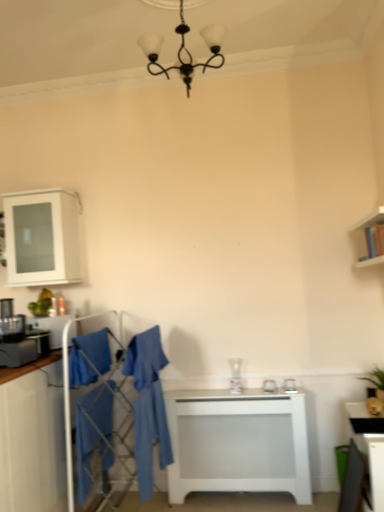
The height and width of the screenshot is (512, 384). Describe the element at coordinates (32, 437) in the screenshot. I see `matte white cabinet at left, the 2th cabinetry positioned from the top` at that location.

This screenshot has height=512, width=384. Describe the element at coordinates (145, 358) in the screenshot. I see `blue fabric robe at center, which is counted as the second robe, starting from the right` at that location.

Describe the element at coordinates (238, 443) in the screenshot. The height and width of the screenshot is (512, 384). I see `white matte table at center, which is counted as the first table, starting from the back` at that location.

The height and width of the screenshot is (512, 384). What are the coordinates of `matte black chair at lower right` in the screenshot? It's located at (354, 481).

Describe the element at coordinates (184, 50) in the screenshot. I see `black glass chandelier at upper center` at that location.

You are a GUI agent. You are given a task and a screenshot of the screen. Output one action in this format:
    pyautogui.click(x=<x>, y=<y>)
    Task: Click on the matte white cabinet at left, the 2th cabinetry positioned from the top
    This screenshot has width=384, height=512.
    Given the screenshot: What is the action you would take?
    pyautogui.click(x=32, y=437)

Considering the sizes of objects white glossy table at lower right, which ranks as the 2th table in left-to-right order, and matte black chair at lower right in the image provided, who is shorter, white glossy table at lower right, which ranks as the 2th table in left-to-right order, or matte black chair at lower right?

matte black chair at lower right.

Is white glossy table at lower right, which ranks as the 2th table in left-to-right order, facing away from matte black chair at lower right?

That's right, white glossy table at lower right, which ranks as the 2th table in left-to-right order, is facing away from matte black chair at lower right.

Is white glossy table at lower right, which is the 1th table in right-to-left order, next to matte black chair at lower right and touching it?

They are not placed beside each other.

Is white glossy table at lower right, the 2th table when ordered from back to front, positioned beyond the bounds of matte black chair at lower right?

white glossy table at lower right, the 2th table when ordered from back to front, lies outside matte black chair at lower right's area.

Is white glossy vase at center, which is the second appliance in front-to-back order, facing away from blue fabric swivel chair at center?

white glossy vase at center, which is the second appliance in front-to-back order, is not turned away from blue fabric swivel chair at center.

The width and height of the screenshot is (384, 512). Find the location of `appliance on the right of blue fabric swivel chair at center`. appliance on the right of blue fabric swivel chair at center is located at coordinates (290, 386).

Can you tell me how much white glossy vase at center, the 1th appliance viewed from the right, and blue fabric swivel chair at center differ in facing direction?

7.27 degrees separate the facing orientations of white glossy vase at center, the 1th appliance viewed from the right, and blue fabric swivel chair at center.

Considering the positions of point (287, 382) and point (100, 415), is point (287, 382) closer or farther from the camera than point (100, 415)?

Point (287, 382) is positioned farther from the camera compared to point (100, 415).

Measure the distance from blue cotton robe at lower left, the second robe when ordered from left to right, to matte white cabinet at left, the 2th cabinetry positioned from the top.

12.72 inches.

Is blue cotton robe at lower left, the third robe from the right, positioned behind matte white cabinet at left, the 2th cabinetry positioned from the top?

Yes.

How different are the orientations of blue cotton robe at lower left, the second robe when ordered from left to right, and matte white cabinet at left, which ranks as the first cabinetry in bottom-to-top order, in degrees?

blue cotton robe at lower left, the second robe when ordered from left to right, and matte white cabinet at left, which ranks as the first cabinetry in bottom-to-top order, are facing 179 degrees away from each other.

Considering the relative positions of blue cotton robe at lower left, the second robe when ordered from left to right, and matte white cabinet at left, the 2th cabinetry positioned from the top, in the image provided, is blue cotton robe at lower left, the second robe when ordered from left to right, to the left or to the right of matte white cabinet at left, the 2th cabinetry positioned from the top,?

In the image, blue cotton robe at lower left, the second robe when ordered from left to right, appears on the right side of matte white cabinet at left, the 2th cabinetry positioned from the top.

This screenshot has height=512, width=384. I want to click on the 2nd cabinetry above the blue cotton robe at center, arranged as the 1th robe when viewed from the right (from the image's perspective), so click(x=42, y=237).

Consider the image. From a real-world perspective, is white glossy cabinet at upper left, which is the 1th cabinetry in top-to-bottom order, on blue cotton robe at center, which appears as the 4th robe when viewed from the left?

Yes, from a real-world perspective, white glossy cabinet at upper left, which is the 1th cabinetry in top-to-bottom order, is on top of blue cotton robe at center, which appears as the 4th robe when viewed from the left.

Based on their positions, is white glossy cabinet at upper left, the 2th cabinetry when ordered from bottom to top, located to the left or right of blue cotton robe at center, which appears as the 4th robe when viewed from the left?

white glossy cabinet at upper left, the 2th cabinetry when ordered from bottom to top, is to the left of blue cotton robe at center, which appears as the 4th robe when viewed from the left.

Is white matte table at center, which is counted as the first table, starting from the back, next to white glossy cabinet at upper left, the 2th cabinetry when ordered from bottom to top, and touching it?

No, white matte table at center, which is counted as the first table, starting from the back, is not making contact with white glossy cabinet at upper left, the 2th cabinetry when ordered from bottom to top.

From a real-world perspective, is white matte table at center, which is counted as the first table, starting from the back, located beneath white glossy cabinet at upper left, which is the 1th cabinetry in top-to-bottom order?

Yes, from a real-world perspective, white matte table at center, which is counted as the first table, starting from the back, is beneath white glossy cabinet at upper left, which is the 1th cabinetry in top-to-bottom order.

Between white matte table at center, the second table positioned from the right, and white glossy cabinet at upper left, the 2th cabinetry when ordered from bottom to top, which one has smaller size?

Smaller between the two is white glossy cabinet at upper left, the 2th cabinetry when ordered from bottom to top.

Which is behind, white matte table at center, placed as the 1th table when sorted from left to right, or white glossy cabinet at upper left, the 2th cabinetry when ordered from bottom to top?

white glossy cabinet at upper left, the 2th cabinetry when ordered from bottom to top, is further away from the camera.

Considering the points (155, 418) and (56, 270), which point is behind, point (155, 418) or point (56, 270)?

The point (56, 270) is farther from the camera.

Does blue cotton robe at center, which appears as the 4th robe when viewed from the left, have a smaller size compared to white glossy cabinet at upper left, which is the 1th cabinetry in top-to-bottom order?

Correct, blue cotton robe at center, which appears as the 4th robe when viewed from the left, occupies less space than white glossy cabinet at upper left, which is the 1th cabinetry in top-to-bottom order.

From the image's perspective, would you say blue cotton robe at center, arranged as the 1th robe when viewed from the right, is positioned over white glossy cabinet at upper left, which is the 1th cabinetry in top-to-bottom order?

Actually, blue cotton robe at center, arranged as the 1th robe when viewed from the right, appears below white glossy cabinet at upper left, which is the 1th cabinetry in top-to-bottom order, in the image.

From a real-world perspective, is blue cotton robe at center, arranged as the 1th robe when viewed from the right, positioned over white glossy cabinet at upper left, which is the 1th cabinetry in top-to-bottom order, based on gravity?

No, from a real-world perspective, blue cotton robe at center, arranged as the 1th robe when viewed from the right, is not above white glossy cabinet at upper left, which is the 1th cabinetry in top-to-bottom order.

Is white matte table at center, the second table positioned from the right, surrounded by blue fabric robe at center, positioned as the third robe in left-to-right order?

No, blue fabric robe at center, positioned as the third robe in left-to-right order, does not contain white matte table at center, the second table positioned from the right.

Which is less distant, [127,375] or [264,417]?

The point [264,417] is closer to the camera.

In the scene shown: Which of these two, blue fabric robe at center, which is counted as the second robe, starting from the right, or white matte table at center, the second table positioned from the right, stands shorter?

blue fabric robe at center, which is counted as the second robe, starting from the right, is shorter.

Can you see blue fabric robe at center, which is counted as the second robe, starting from the right, touching white matte table at center, marked as the 2th table in a front-to-back arrangement?

No, blue fabric robe at center, which is counted as the second robe, starting from the right, is not beside white matte table at center, marked as the 2th table in a front-to-back arrangement.

Where is `table lying on the right of matte black chair at lower right`? table lying on the right of matte black chair at lower right is located at coordinates (369, 446).

This screenshot has height=512, width=384. I want to click on swivel chair in front of the white glossy vase at center, the second appliance viewed from the left, so click(x=148, y=405).

Which object lies further to the anchor point white glossy cabinet at upper left, which is the 1th cabinetry in top-to-bottom order, blue cotton robe at lower left, the third robe from the right, or white matte table at center, marked as the 2th table in a front-to-back arrangement?

white matte table at center, marked as the 2th table in a front-to-back arrangement, lies further to white glossy cabinet at upper left, which is the 1th cabinetry in top-to-bottom order, than the other object.

From the image, which object appears to be nearer to blue cotton robe at center, arranged as the 1th robe when viewed from the right, matte white cabinet at left, the 2th cabinetry positioned from the top, or blue fabric swivel chair at center?

blue fabric swivel chair at center lies closer to blue cotton robe at center, arranged as the 1th robe when viewed from the right, than the other object.

Looking at the image, which one is located closer to blue fabric robe at center, marked as the first robe in a left-to-right arrangement, matte black chair at lower right or white glossy cabinet at upper left, which is the 1th cabinetry in top-to-bottom order?

The object closer to blue fabric robe at center, marked as the first robe in a left-to-right arrangement, is white glossy cabinet at upper left, which is the 1th cabinetry in top-to-bottom order.

Based on the photo, which object lies nearer to the anchor point white matte table at center, the second table positioned from the right, blue fabric robe at center, which is counted as the second robe, starting from the right, or blue fabric swivel chair at center?

The object closer to white matte table at center, the second table positioned from the right, is blue fabric swivel chair at center.

Looking at the image, which one is located closer to blue cotton robe at center, which appears as the 4th robe when viewed from the left, white glossy table at lower right, the 2th table when ordered from back to front, or blue fabric robe at center, marked as the first robe in a left-to-right arrangement?

blue fabric robe at center, marked as the first robe in a left-to-right arrangement, lies closer to blue cotton robe at center, which appears as the 4th robe when viewed from the left, than the other object.

Estimate the real-world distances between objects in this image. Which object is further from matte white cabinet at left, the 2th cabinetry positioned from the top, matte black chair at lower right or white matte table at center, the second table positioned from the right?

Among the two, matte black chair at lower right is located further to matte white cabinet at left, the 2th cabinetry positioned from the top.

When comparing their distances from white glossy cabinet at upper left, the 2th cabinetry when ordered from bottom to top, does blue cotton robe at lower left, the third robe from the right, or blue fabric robe at center, positioned as the third robe in left-to-right order, seem closer?

The object closer to white glossy cabinet at upper left, the 2th cabinetry when ordered from bottom to top, is blue fabric robe at center, positioned as the third robe in left-to-right order.

Based on their spatial positions, is blue fabric robe at center, the fourth robe from the right, or blue cotton robe at center, which appears as the 4th robe when viewed from the left, closer to blue fabric swivel chair at center?

blue cotton robe at center, which appears as the 4th robe when viewed from the left, is closer to blue fabric swivel chair at center.

The height and width of the screenshot is (512, 384). Find the location of `robe between blue fabric robe at center, which is counted as the second robe, starting from the right, and white glossy vase at center, the second appliance viewed from the left, from left to right`. robe between blue fabric robe at center, which is counted as the second robe, starting from the right, and white glossy vase at center, the second appliance viewed from the left, from left to right is located at coordinates (150, 436).

Locate an element on the screen. The height and width of the screenshot is (512, 384). swivel chair between matte white cabinet at left, the 2th cabinetry positioned from the top, and white glossy table at lower right, which ranks as the 2th table in left-to-right order, in the horizontal direction is located at coordinates (148, 405).

This screenshot has width=384, height=512. What are the coordinates of `chair positioned between white glossy table at lower right, the 2th table when ordered from back to front, and white matte table at center, which is counted as the first table, starting from the back, from near to far` in the screenshot? It's located at (354, 481).

Locate an element on the screen. The height and width of the screenshot is (512, 384). appliance between blue fabric robe at center, the fourth robe from the right, and white glossy table at lower right, which ranks as the 2th table in left-to-right order is located at coordinates (290, 386).